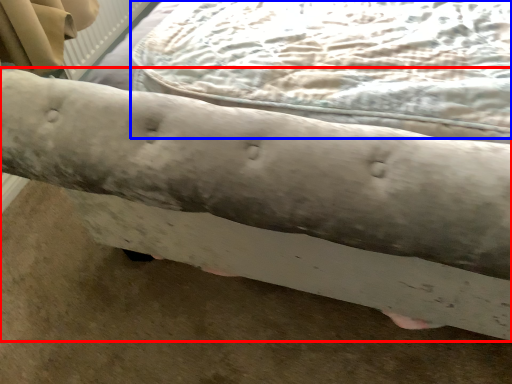
Question: Among these objects, which one is farthest to the camera, furniture (highlighted by a red box) or sheet (highlighted by a blue box)?

Choices:
 (A) furniture
 (B) sheet

Answer: (B)